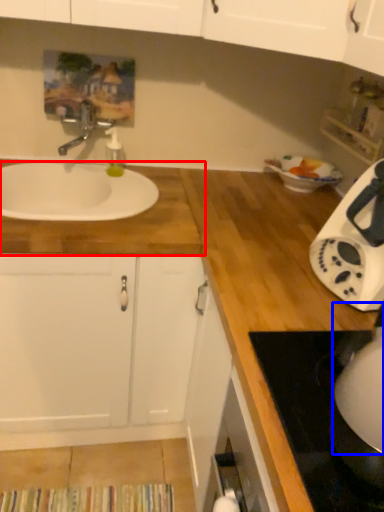
Question: Which object is further to the camera taking this photo, countertop (highlighted by a red box) or appliance (highlighted by a blue box)?

Choices:
 (A) countertop
 (B) appliance

Answer: (A)